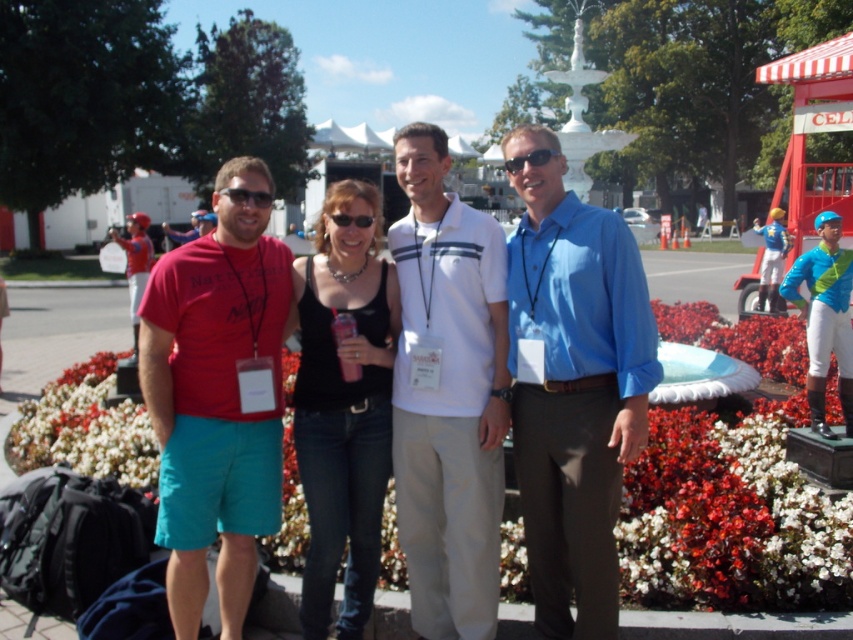
Question: Is matte red t-shirt at left positioned at the back of black denim jeans at center?

Choices:
 (A) yes
 (B) no

Answer: (B)

Question: Among these objects, which one is nearest to the camera?

Choices:
 (A) white matte flowers at lower center
 (B) black plastic sunglasses at center
 (C) blue cotton shirt at center
 (D) matte red t-shirt at left

Answer: (C)

Question: Among these points, which one is nearest to the camera?

Choices:
 (A) (345, 218)
 (B) (795, 396)
 (C) (376, 419)
 (D) (511, 172)

Answer: (D)

Question: Which is nearer to the blue cotton shirt at center?

Choices:
 (A) black plastic goggles at center
 (B) black plastic sunglasses at center
 (C) white matte flowers at lower center
 (D) black denim jeans at center

Answer: (D)

Question: Considering the relative positions of white matte flowers at lower center and blue cotton shirt at center in the image provided, where is white matte flowers at lower center located with respect to blue cotton shirt at center?

Choices:
 (A) right
 (B) left

Answer: (A)

Question: From the image, what is the correct spatial relationship of blue cotton shirt at center in relation to white cotton polo shirt at center?

Choices:
 (A) left
 (B) right

Answer: (B)